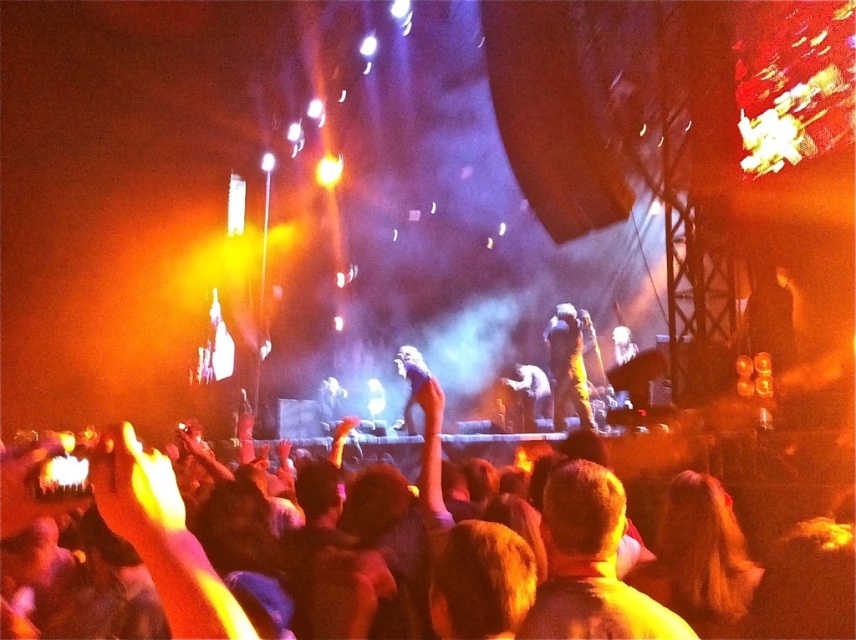
This screenshot has width=856, height=640. I want to click on matte gold jacket at center, so click(568, 365).

Can you confirm if matte gold jacket at center is taller than shiny silver microphone at center?

Yes, matte gold jacket at center is taller than shiny silver microphone at center.

Where is `matte gold jacket at center`? The width and height of the screenshot is (856, 640). matte gold jacket at center is located at coordinates (568, 365).